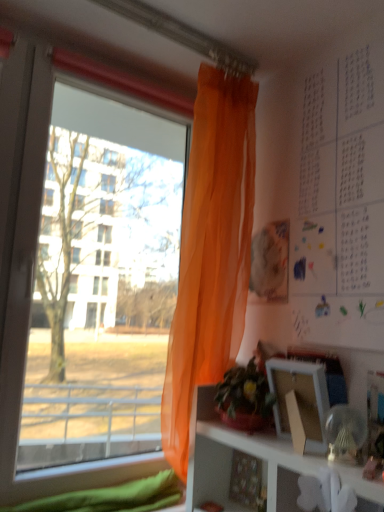
Question: Could you tell me if white paper at upper right is turned towards green leafy plant at center?

Choices:
 (A) no
 (B) yes

Answer: (A)

Question: Is white paper at upper right next to green leafy plant at center?

Choices:
 (A) yes
 (B) no

Answer: (B)

Question: From the image's perspective, is white paper at upper right under green leafy plant at center?

Choices:
 (A) no
 (B) yes

Answer: (A)

Question: Can you confirm if white paper at upper right is shorter than green leafy plant at center?

Choices:
 (A) yes
 (B) no

Answer: (B)

Question: From a real-world perspective, is white paper at upper right positioned over green leafy plant at center based on gravity?

Choices:
 (A) no
 (B) yes

Answer: (B)

Question: Is white paper at upper right further to the viewer compared to green leafy plant at center?

Choices:
 (A) no
 (B) yes

Answer: (A)

Question: From the image's perspective, would you say translucent orange curtain at left is positioned over transparent orange curtain at left?

Choices:
 (A) yes
 (B) no

Answer: (B)

Question: Can you confirm if translucent orange curtain at left is positioned to the right of transparent orange curtain at left?

Choices:
 (A) yes
 (B) no

Answer: (A)

Question: Can you confirm if translucent orange curtain at left is bigger than transparent orange curtain at left?

Choices:
 (A) yes
 (B) no

Answer: (B)

Question: Is translucent orange curtain at left located outside transparent orange curtain at left?

Choices:
 (A) no
 (B) yes

Answer: (B)

Question: Could you tell me if translucent orange curtain at left is facing transparent orange curtain at left?

Choices:
 (A) no
 (B) yes

Answer: (A)

Question: Is translucent orange curtain at left further to the viewer compared to transparent orange curtain at left?

Choices:
 (A) yes
 (B) no

Answer: (A)

Question: Is translucent orange curtain at left positioned beyond the bounds of white matte picture frame at lower right?

Choices:
 (A) yes
 (B) no

Answer: (A)